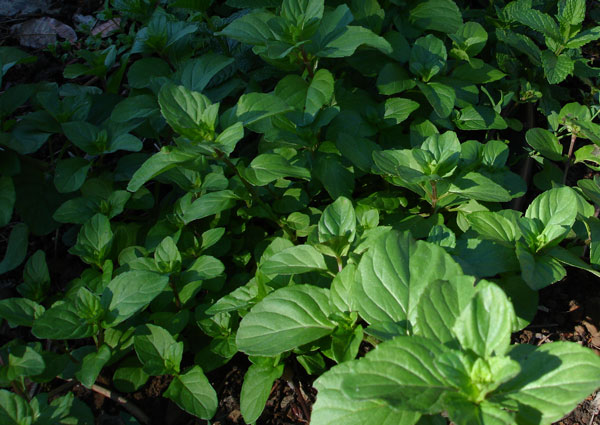
Locate an element on the screen. shade is located at coordinates (81, 134).